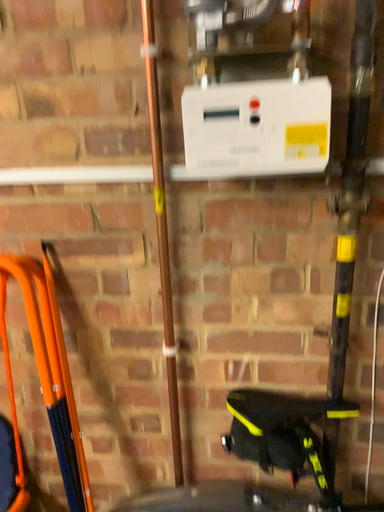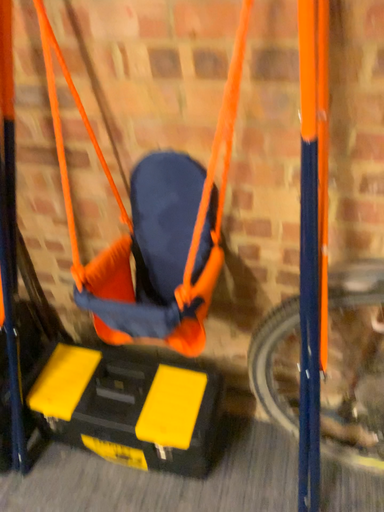
Question: How did the camera likely rotate when shooting the video?

Choices:
 (A) rotated left
 (B) rotated right

Answer: (A)